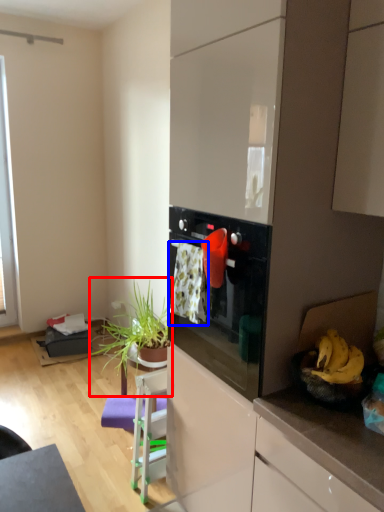
Question: Which point is closer to the camera, houseplant (highlighted by a red box) or laundry (highlighted by a blue box)?

Choices:
 (A) houseplant
 (B) laundry

Answer: (B)